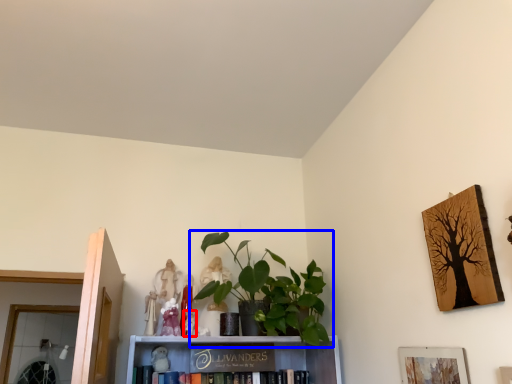
Question: Which point is closer to the camera, toy (highlighted by a red box) or houseplant (highlighted by a blue box)?

Choices:
 (A) toy
 (B) houseplant

Answer: (B)